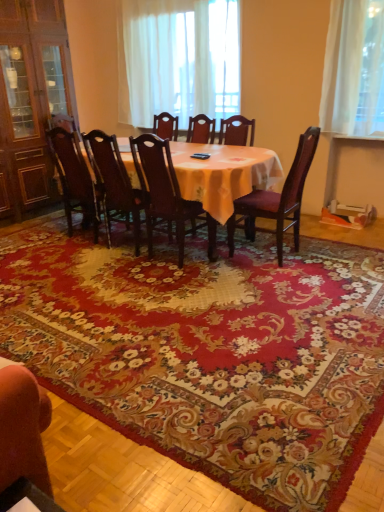
Locate an element on the screen. The image size is (384, 512). free space to the right of wooden chair with purple cushion at right, placed as the 1th chair when sorted from right to left is located at coordinates (x=328, y=256).